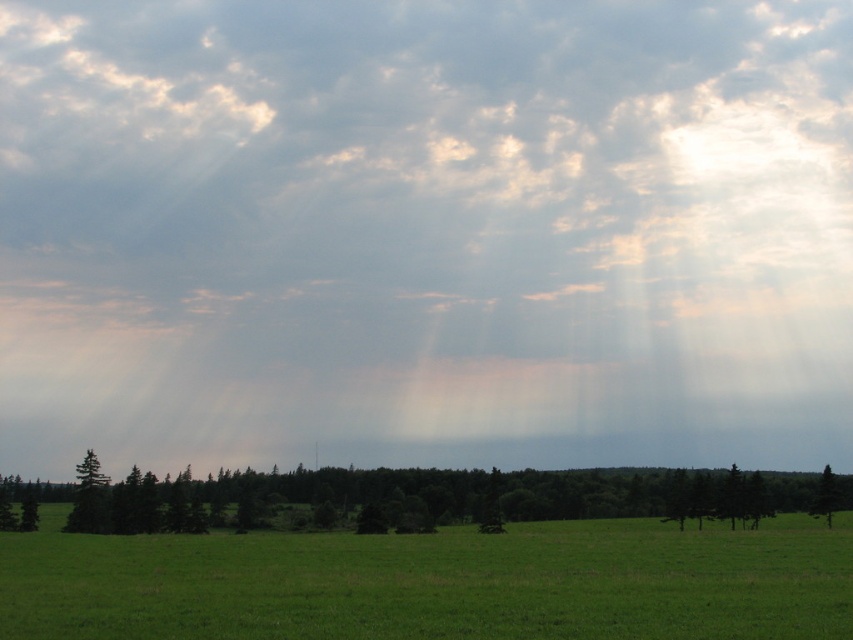
Is green grassy field at lower center below green matte tree at lower right?

Actually, green grassy field at lower center is above green matte tree at lower right.

Between point (811, 524) and point (819, 509), which one is positioned behind?

Positioned behind is point (819, 509).

At what (x,y) coordinates should I click in order to perform the action: click on green grassy field at lower center. Please return your answer as a coordinate pair (x, y). This screenshot has height=640, width=853. Looking at the image, I should click on (434, 582).

Is green matte tree at lower left to the left of green matte tree at lower right from the viewer's perspective?

Indeed, green matte tree at lower left is positioned on the left side of green matte tree at lower right.

Can you confirm if green matte tree at lower left is smaller than green matte tree at lower right?

Correct, green matte tree at lower left occupies less space than green matte tree at lower right.

The height and width of the screenshot is (640, 853). What do you see at coordinates (88, 497) in the screenshot?
I see `green matte tree at lower left` at bounding box center [88, 497].

Locate an element on the screen. This screenshot has height=640, width=853. green matte tree at lower left is located at coordinates (88, 497).

Does point (840, 68) come behind point (451, 504)?

Yes, it is behind point (451, 504).

Is cloudy sky at upper center bigger than green matte tree at lower center?

Yes.

Which is in front, point (390, 461) or point (538, 508)?

Point (538, 508) is in front.

At what (x,y) coordinates should I click in order to perform the action: click on cloudy sky at upper center. Please return your answer as a coordinate pair (x, y). Image resolution: width=853 pixels, height=640 pixels. Looking at the image, I should click on (425, 232).